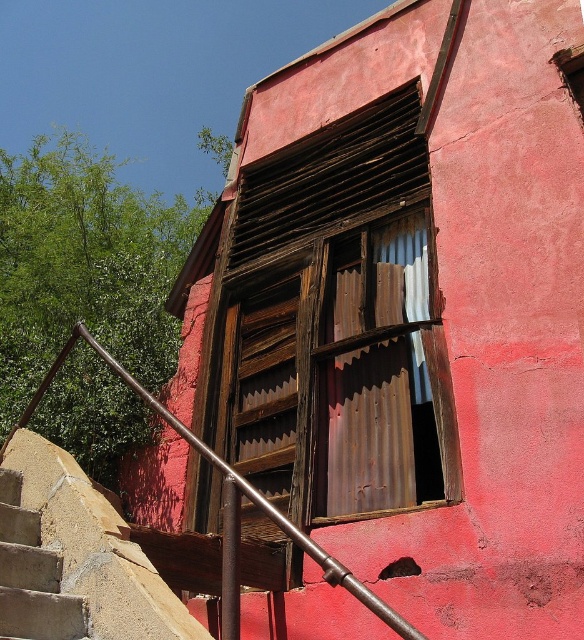
Question: In this image, where is rusty metal window at center located relative to smooth concrete steps at lower left?

Choices:
 (A) right
 (B) left

Answer: (A)

Question: Does smooth concrete steps at lower left appear on the left side of brown metal/rustic handrail at lower left?

Choices:
 (A) no
 (B) yes

Answer: (B)

Question: Which object is closer to the camera taking this photo?

Choices:
 (A) brown metal/rustic handrail at lower left
 (B) concrete textured stairs at lower left
 (C) rusty metal window at center

Answer: (B)

Question: Which point is closer to the camera?

Choices:
 (A) concrete textured stairs at lower left
 (B) rusty metal window at center

Answer: (A)

Question: Which of the following is the farthest from the observer?

Choices:
 (A) brown metal/rustic handrail at lower left
 (B) rusty metal window at center
 (C) concrete textured stairs at lower left

Answer: (B)

Question: Is smooth concrete steps at lower left positioned in front of brown metal/rustic handrail at lower left?

Choices:
 (A) yes
 (B) no

Answer: (A)